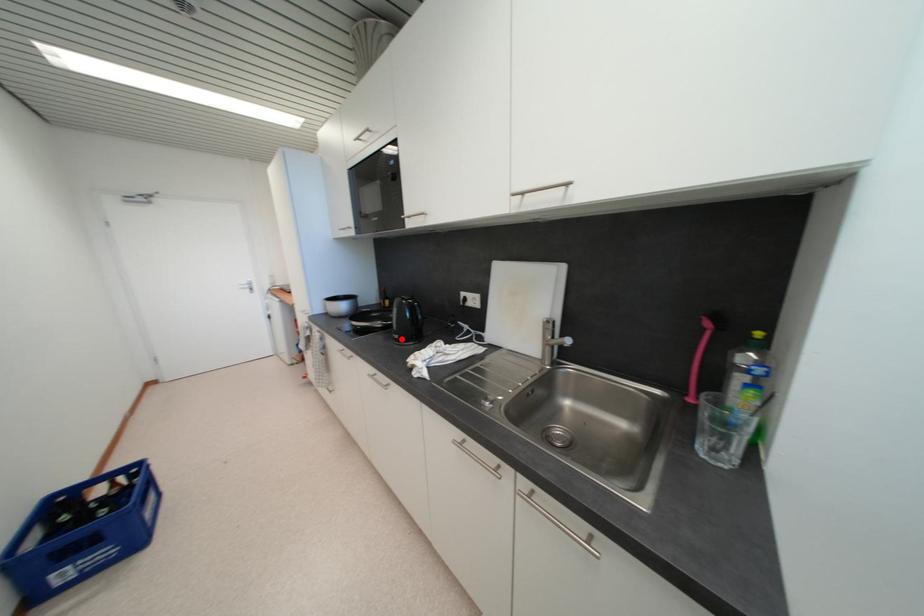
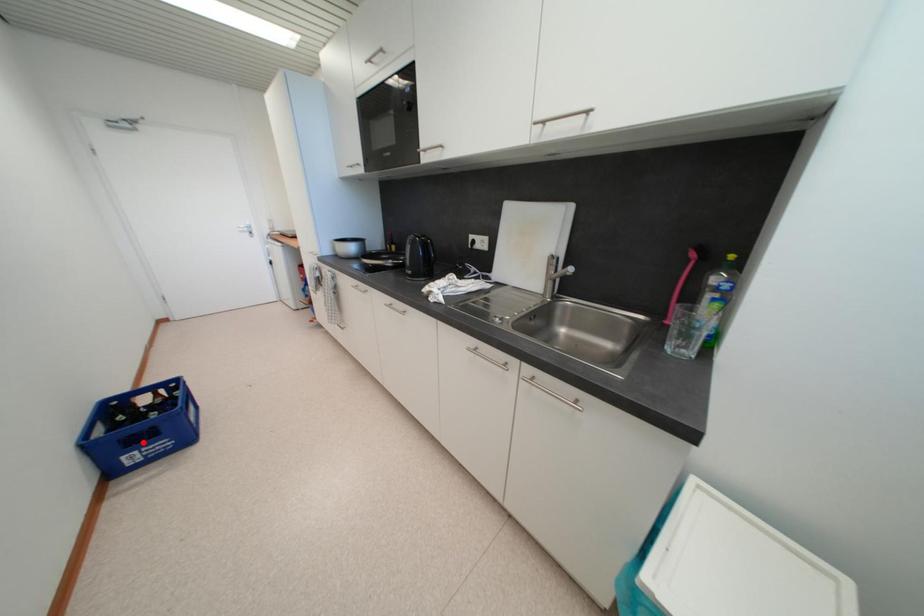
I am providing you with two images of the same scene from different viewpoints. A red point is marked on the first image and another point is marked on the second image. Is the marked point in image1 the same physical position as the marked point in image2?

No